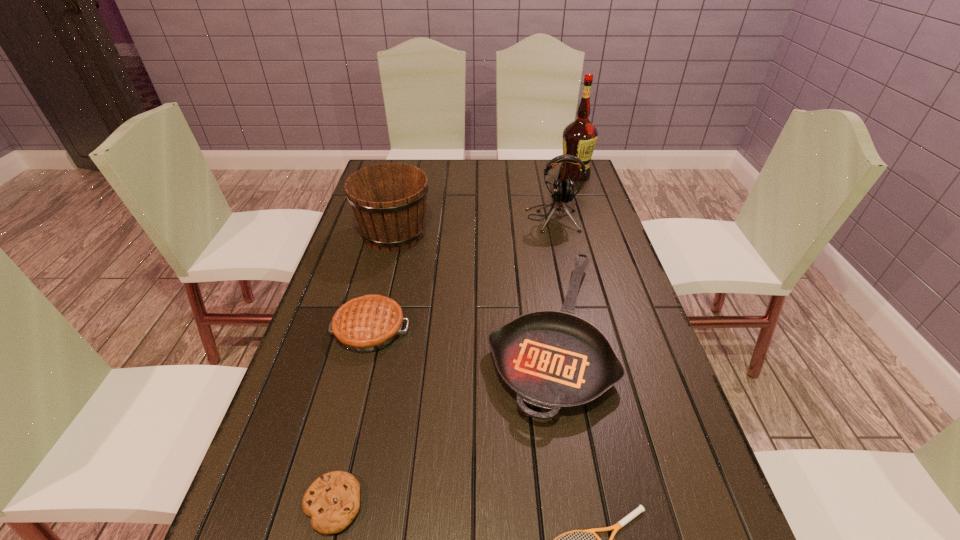
Where is `object present at the far right corner`? This screenshot has height=540, width=960. object present at the far right corner is located at coordinates (579, 137).

This screenshot has width=960, height=540. Identify the location of free region at the far edge. (513, 161).

In order to click on free space at the left edge of the desktop in this screenshot , I will do point(295,440).

In the image, there is a desktop. Where is `vacant area at the right edge`? This screenshot has height=540, width=960. vacant area at the right edge is located at coordinates (604, 324).

Find the location of a particular element. The height and width of the screenshot is (540, 960). free spot between the frying pan and the wine bucket is located at coordinates (x=470, y=282).

Locate an element on the screen. The height and width of the screenshot is (540, 960). free space between the pie and the third shortest object is located at coordinates (459, 330).

Locate an element on the screen. This screenshot has height=540, width=960. free space between the pie and the tallest object is located at coordinates (472, 252).

Where is `empty space that is in between the pie and the frying pan`? Image resolution: width=960 pixels, height=540 pixels. empty space that is in between the pie and the frying pan is located at coordinates (459, 330).

Locate an element on the screen. The height and width of the screenshot is (540, 960). free space between the pie and the earphone is located at coordinates (461, 274).

Find the location of a particular element. This screenshot has height=540, width=960. free point between the sixth tallest object and the wine bucket is located at coordinates (364, 369).